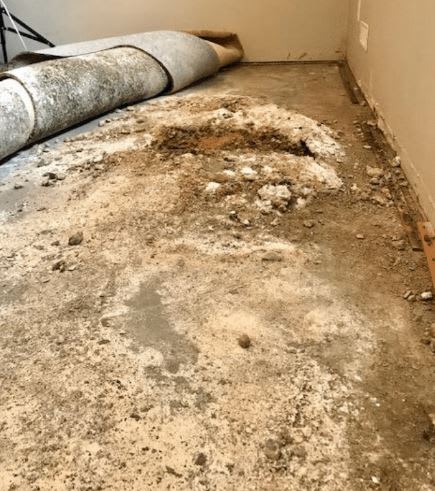
The height and width of the screenshot is (491, 435). What are the coordinates of `beige walls` in the screenshot? It's located at click(x=271, y=21), click(x=399, y=93).